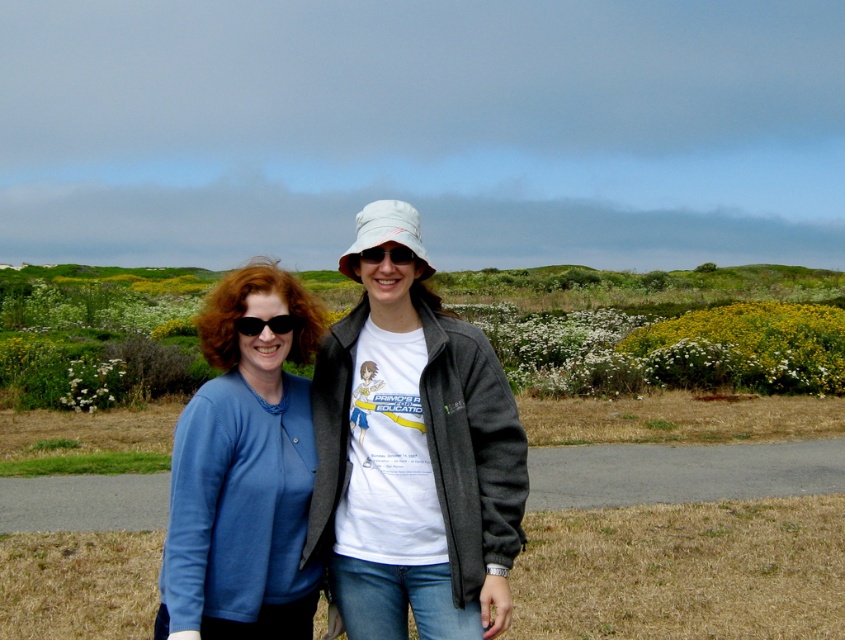
You are a photographer setting up a tripod to take a group photo of the two people in the scene. The matte blue cardigan at left and the black plastic sunglasses at center are in your camera frame. Which object should you adjust your focus on if you want to ensure both are in sharp focus?

The matte blue cardigan at left is much taller than the black plastic sunglasses at center, so focusing on the matte blue cardigan at left would ensure both objects are within the depth of field and in sharp focus.

In the scene shown: You are a photographer trying to capture a photo of both individuals in the scene. You notice two points marked in the image. The first point, point (341,266), is behind point (413,253). Which point should you focus on to ensure both individuals are in focus?

To ensure both individuals are in focus, you should focus on point (413,253) because it is closer to the photographer than point (341,266), which is behind it. By focusing on the closer point, the depth of field may include both subjects.

You are a photographer trying to capture a closeup of the black plastic sunglasses at center. However, the matte blue cardigan at left is blocking your view. Which direction should you move to avoid the obstruction?

You should move to the right side of the matte blue cardigan at left to avoid the obstruction since the matte blue cardigan at left is to the left of the black plastic sunglasses at center.